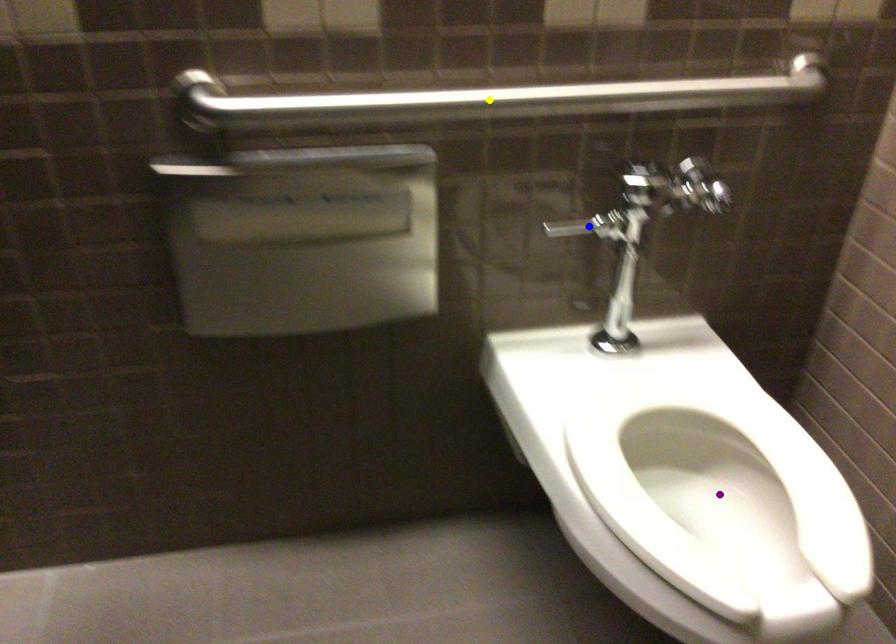
Order these from nearest to farthest:
yellow point | purple point | blue point

purple point < yellow point < blue point